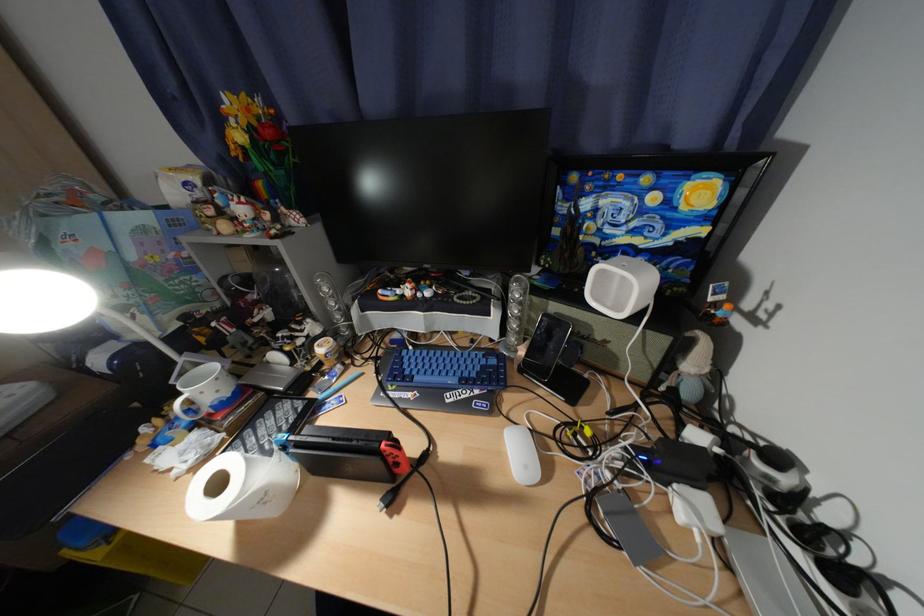
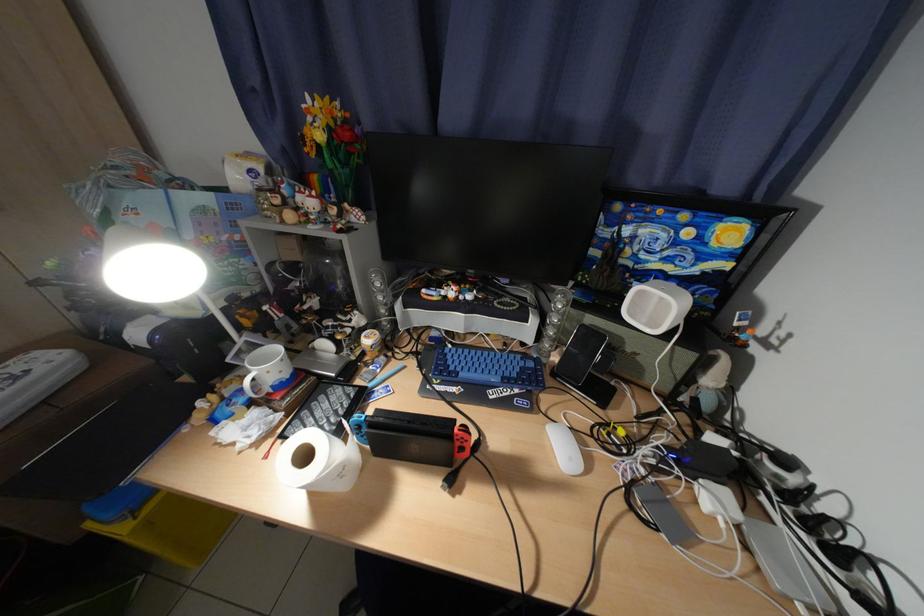
Locate, in the second image, the point that corresponds to (x=631, y=466) in the first image.

(664, 463)